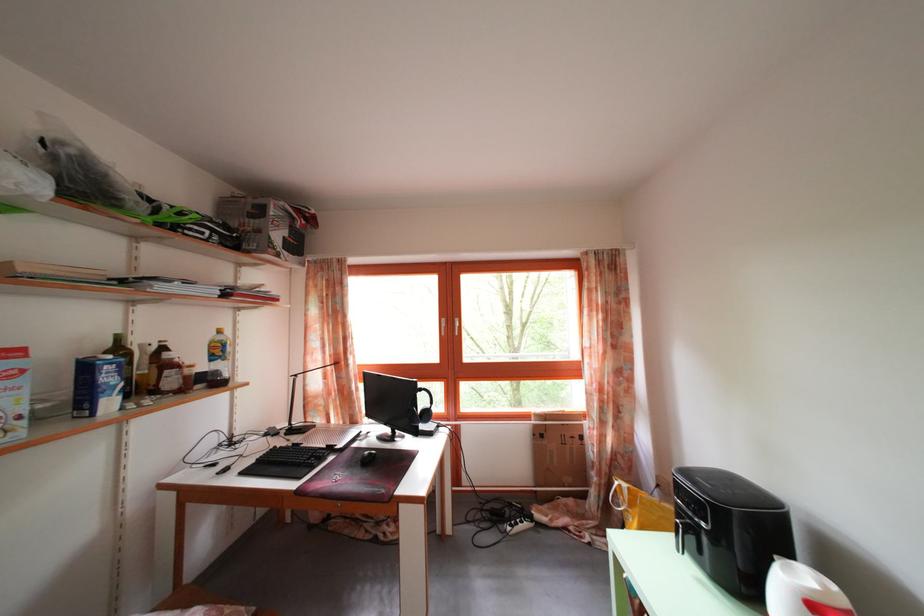
In order to click on brown cardboard box in this screenshot , I will do `click(558, 448)`.